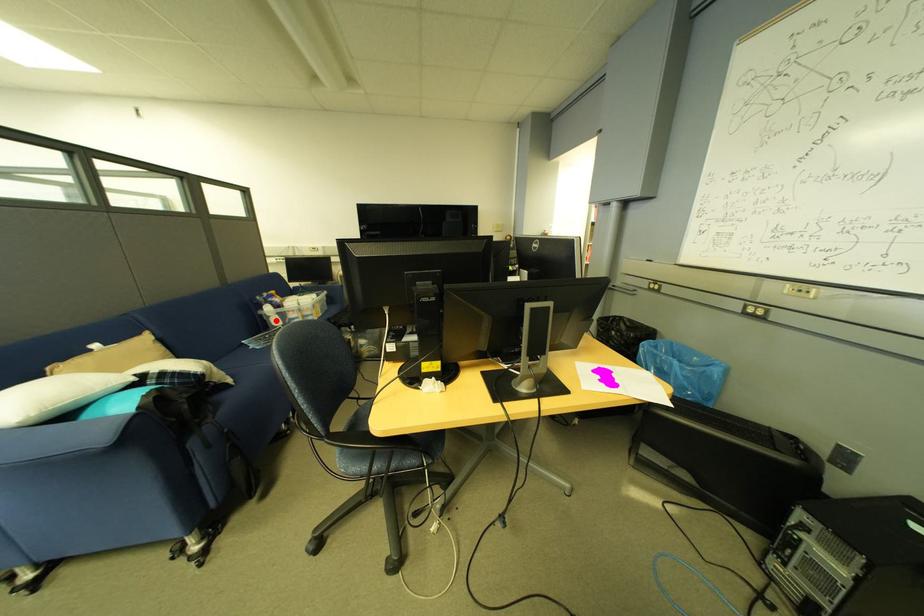
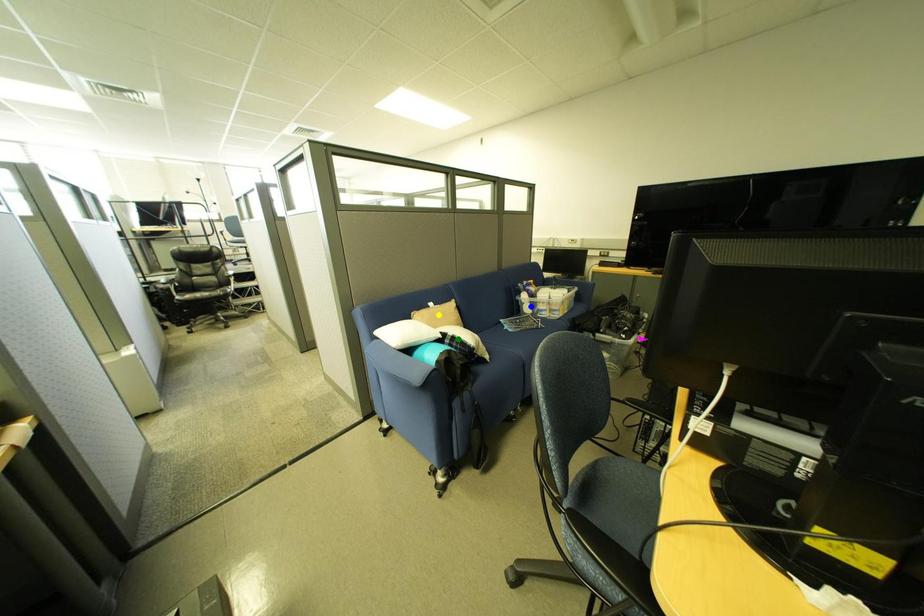
Question: I am providing you with two images of the same scene from different viewpoints. A red point is marked on the first image. You are given multiple points on the second image. Which point in image 2 represents the same 3d spot as the red point in image 1?

Choices:
 (A) yellow point
 (B) blue point
 (C) green point

Answer: (B)